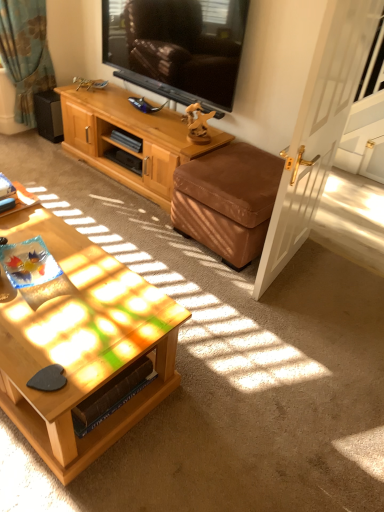
Identify the location of vacant space to the right of woodenobject at lower left. The width and height of the screenshot is (384, 512). pos(240,376).